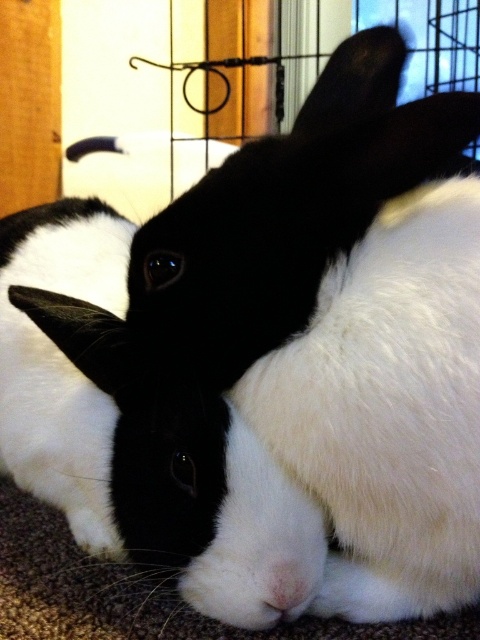
You are a small toy mouse that is 5 cm wide. You want to hide behind the wooden screen door at upper left and the white soft fur nose at center. Which object can you hide behind without being seen if you choose the wider one?

The wooden screen door at upper left is wider than the white soft fur nose at center, so you can hide behind the wooden screen door at upper left without being seen because it is wider than the toy mouse.

You are a small robot with a width of 2 feet. You need to move from the wooden screen door at upper left to the white soft fur nose at center. Is there enough space between them for you to pass through?

The wooden screen door at upper left and the white soft fur nose at center are 5.51 feet apart, so yes, the robot can pass through since the distance is greater than its 2 feet width.